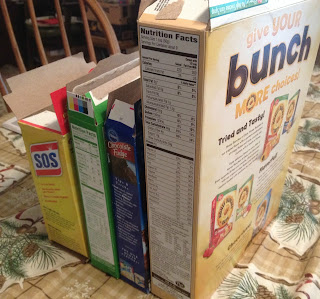
Image resolution: width=320 pixels, height=299 pixels. I want to click on table, so click(38, 292).